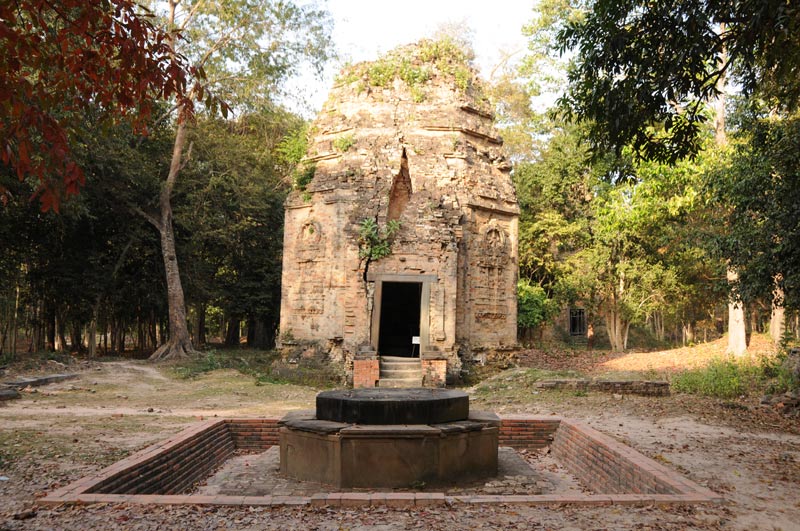
I want to click on steps leading to doorway, so click(398, 368).